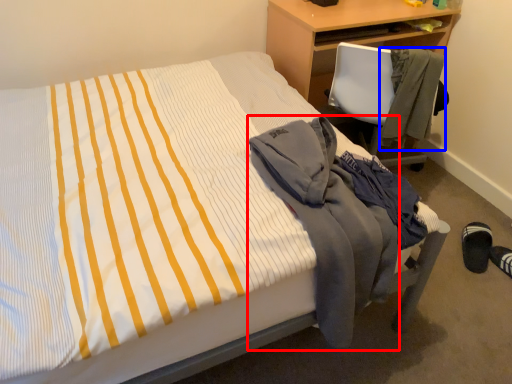
Question: Which of the following is the farthest to the observer, jacket (highlighted by a red box) or jacket (highlighted by a blue box)?

Choices:
 (A) jacket
 (B) jacket

Answer: (B)